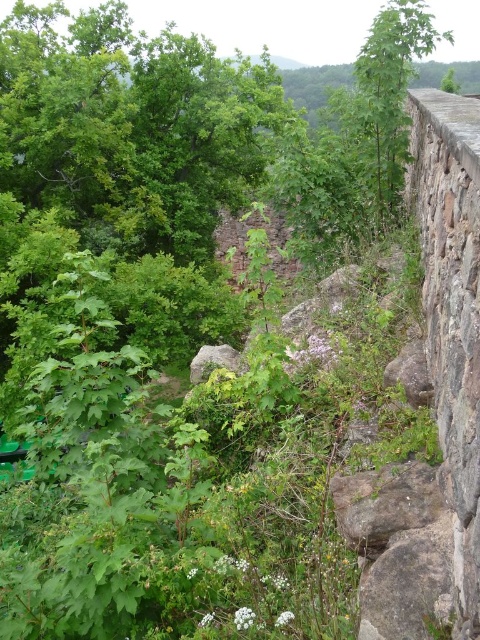
Does green leafy tree at upper right have a lesser height compared to brown rough rock at center?

Incorrect, green leafy tree at upper right's height does not fall short of brown rough rock at center's.

Does green leafy tree at upper right appear on the left side of brown rough rock at center?

No, green leafy tree at upper right is not to the left of brown rough rock at center.

Is point (407, 129) closer to viewer compared to point (371, 486)?

No.

Find the location of a particular element. green leafy tree at upper right is located at coordinates [389, 92].

Is green leafy tree at upper right taller than gray rough rock at lower right?

Correct, green leafy tree at upper right is much taller as gray rough rock at lower right.

Who is higher up, green leafy tree at upper right or gray rough rock at lower right?

green leafy tree at upper right

Looking at this image, who is more distant from viewer, (x=375, y=193) or (x=363, y=573)?

Point (x=375, y=193)

This screenshot has height=640, width=480. I want to click on green leafy tree at upper right, so click(389, 92).

Is gray rough rock at lower right taller than brown rough rock at center?

Yes.

At what (x,y) coordinates should I click in order to perform the action: click on gray rough rock at lower right. Please return your answer as a coordinate pair (x, y). The height and width of the screenshot is (640, 480). Looking at the image, I should click on (408, 582).